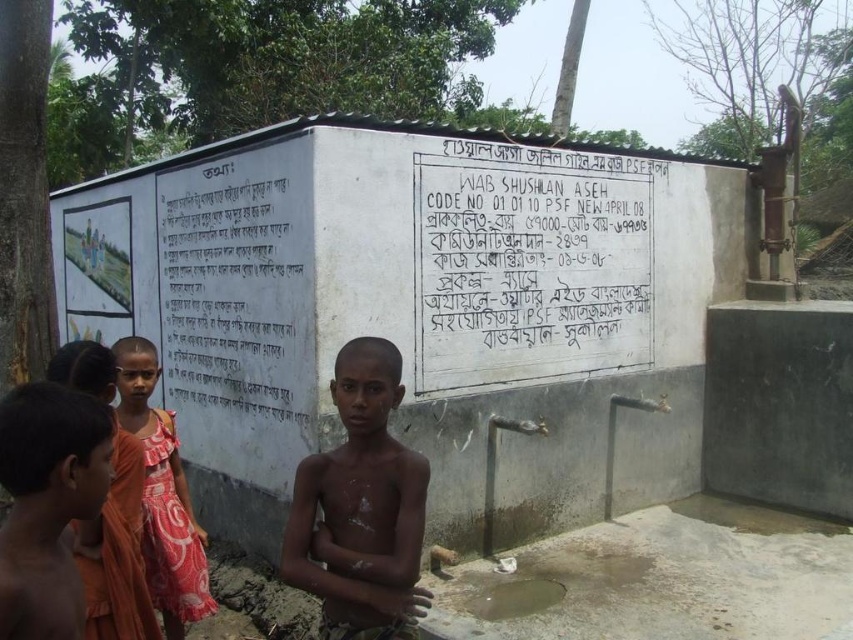
You are a photographer standing in front of the water pump station. You want to take a picture of the brown skin boy at lower left and the white paper at center. Which object is wider in the image?

The white paper at center might be wider than brown skin boy at lower left according to the description.

You are a photographer trying to capture the three children in front of the water pump station. You notice the brown skin boy at lower left and the orange fabric dress at lower left. Which of these two has a smaller width?

The brown skin boy at lower left has a lesser width compared to the orange fabric dress at lower left, so the brown skin boy at lower left is smaller in width.